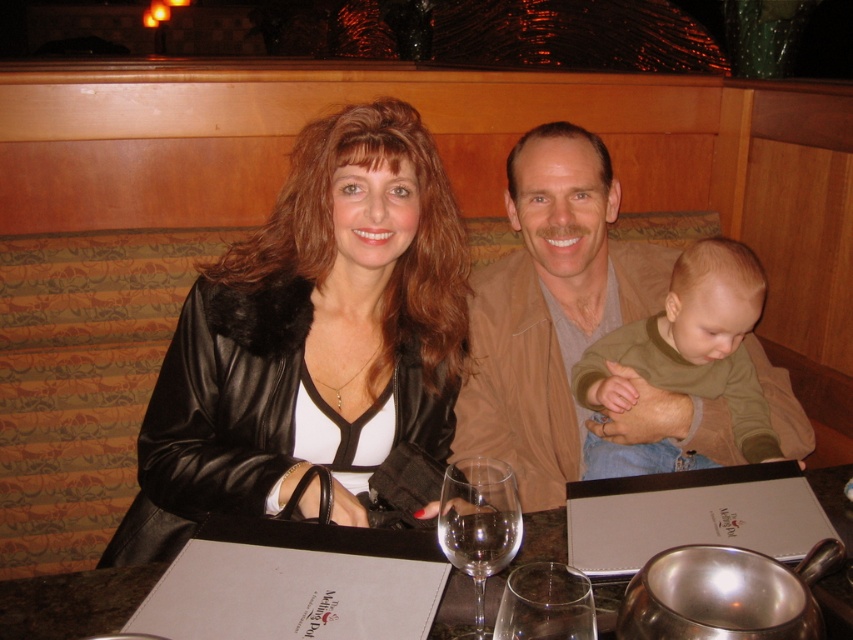
You are a photographer standing at the camera position. You want to place a tan leather jacket at center closer to the camera without moving the camera. What action should you take?

To move the tan leather jacket at center closer to the camera, you need to physically move the jacket itself towards the camera since the camera cannot be moved. The current distance between them is 4.52 feet, so adjusting the jacket position would reduce this distance.

What object is located at the coordinates point (310, 339)?

The black leather jacket at center is located at point (310, 339).